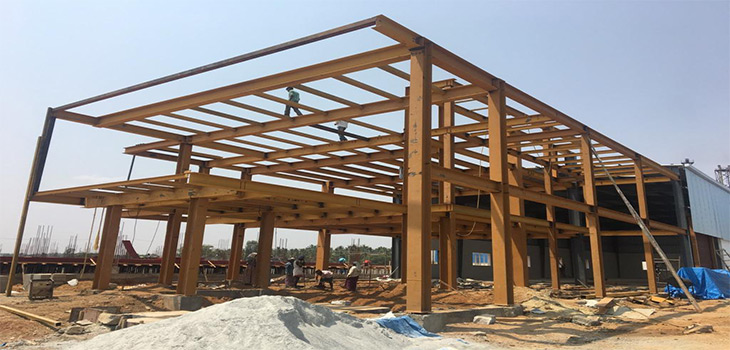
Where is `windows`? windows is located at coordinates (488, 258), (434, 255), (644, 269).